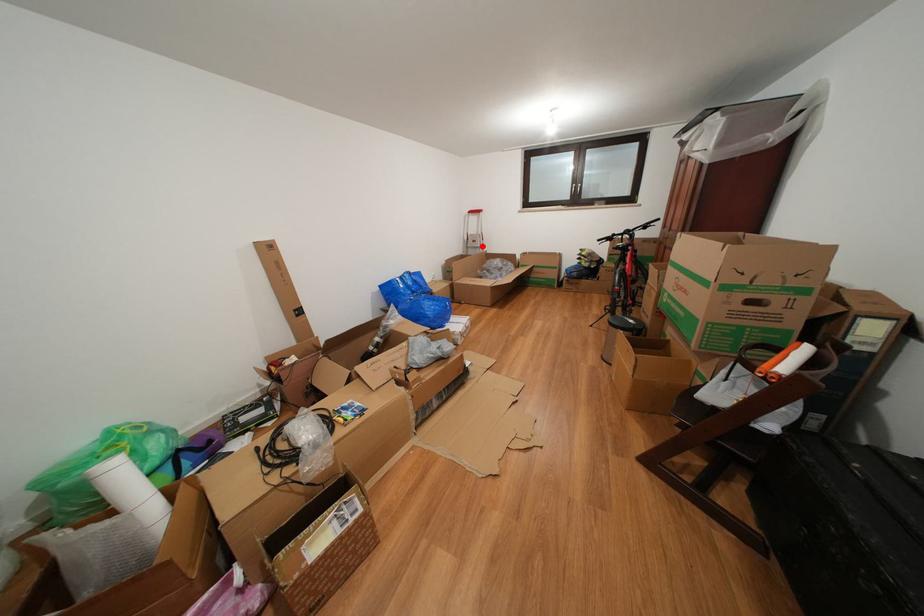
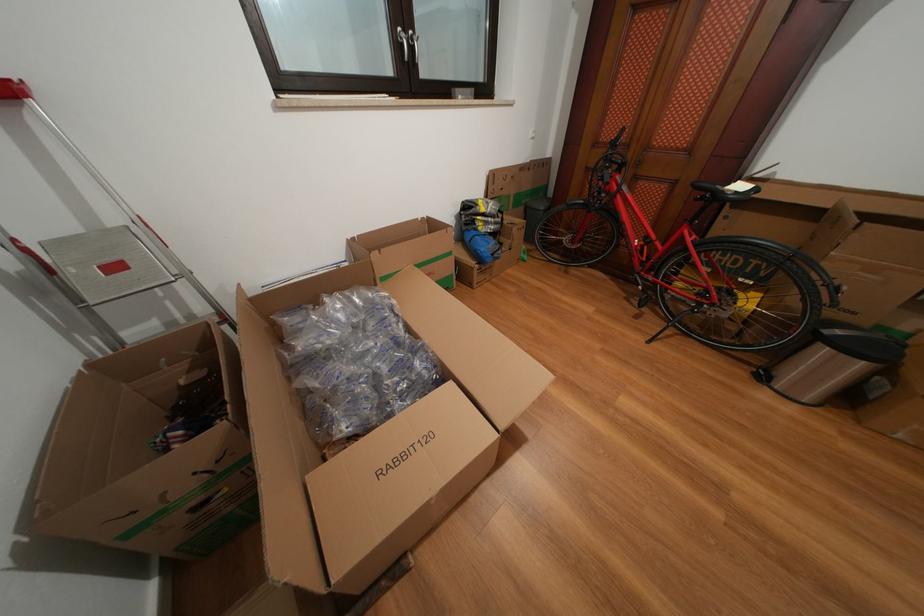
Find the pixel in the second image that matches the highlighted location in the first image.

(124, 273)